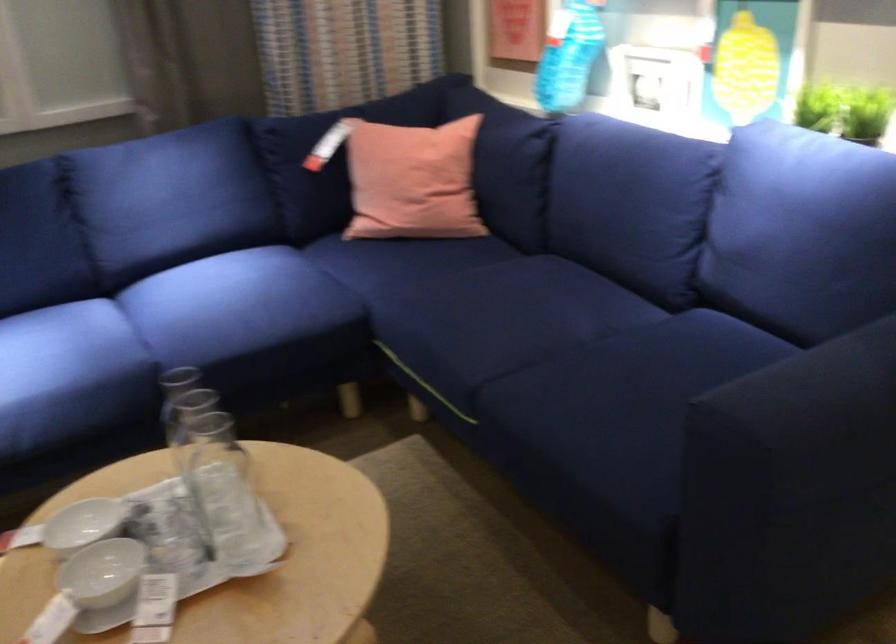
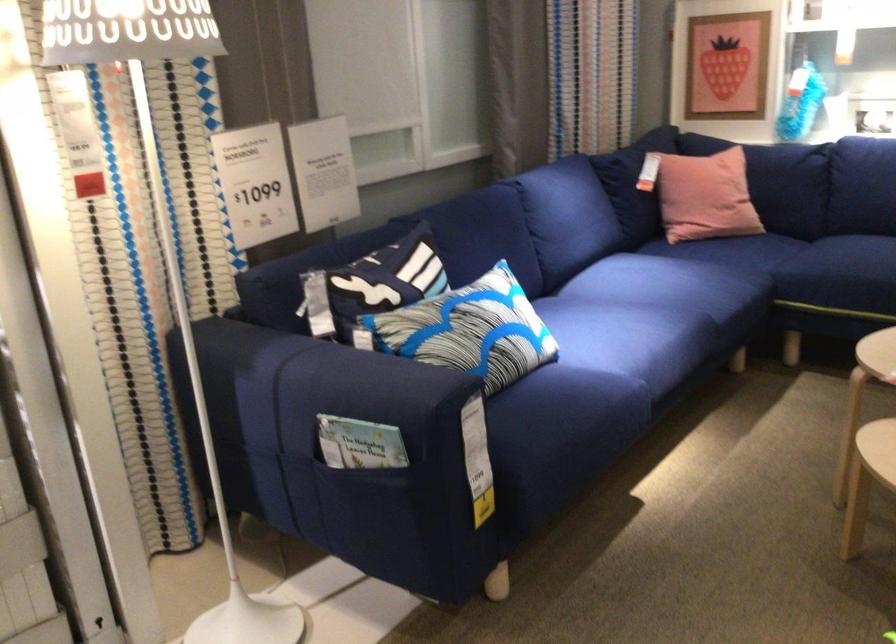
Where in the second image is the point corresponding to pixel 441 182 from the first image?

(759, 176)